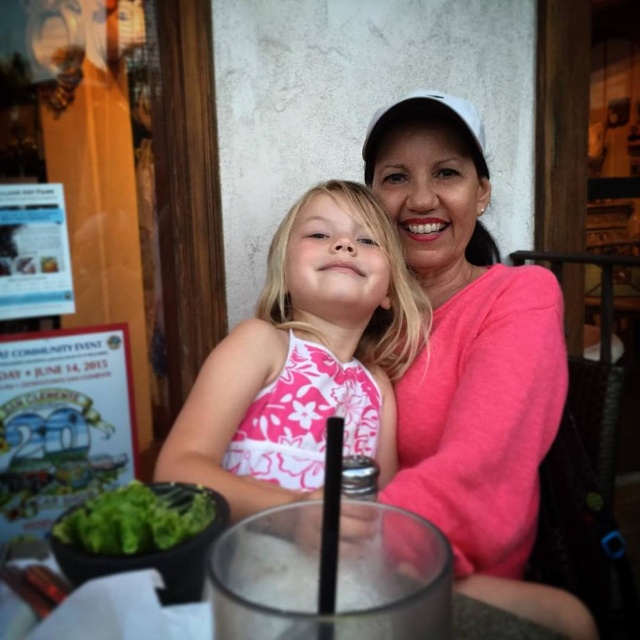
You are a photographer taking a picture of the scene. You notice the pink floral dress at center and the green leafy vegetable at lower left. Which object is positioned higher from the ground?

The pink floral dress at center is located above the green leafy vegetable at lower left, so it is positioned higher from the ground.

You are a photographer trying to capture a closeup of the pink floral dress at center. Based on the coordinates provided, where should you position your camera relative to the table?

The pink floral dress at center is located at coordinates point (x=304, y=356), so the camera should be positioned slightly to the right and above the center of the table to capture the dress in focus.

Based on the photo, you are a photographer taking a picture of the pink cotton sweater at upper right and the green leafy vegetable at lower left. Which object should you adjust to ensure both are centered in the frame?

The pink cotton sweater at upper right is positioned on the right side of green leafy vegetable at lower left, so you should move the pink cotton sweater at upper right to the left to center both objects in the frame.